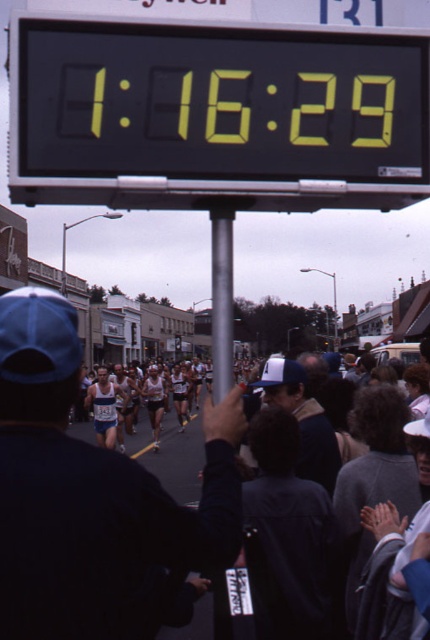
You are a runner in the marathon and want to check your current time. You see the yellow digital display at upper center and the silver metallic pole at center. Which object is closer to you?

The yellow digital display at upper center is closer to you since it is only 1.33 meters away from the silver metallic pole at center, but since both are part of the same structure, you can check the time on the yellow digital display at upper center mounted on the silver metallic pole at center.